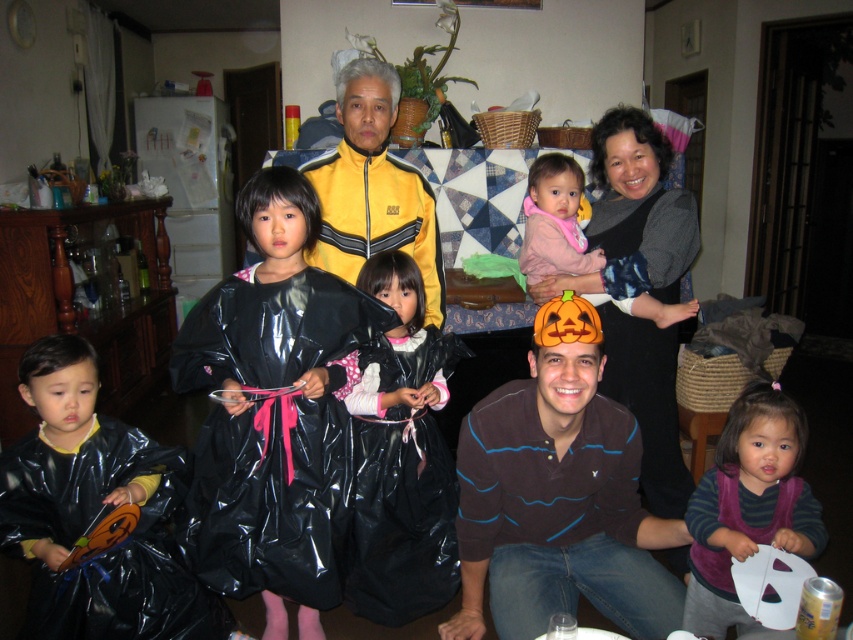
Question: Which object is closer to the camera taking this photo?

Choices:
 (A) shiny black cape at center
 (B) brown striped shirt at center
 (C) yellowmaterial/texturejacket at upper center

Answer: (B)

Question: Which object is farther from the camera taking this photo?

Choices:
 (A) brown striped shirt at center
 (B) shiny black cape at center
 (C) yellowmaterial/texturejacket at upper center

Answer: (C)

Question: Does glossy black plastic bag at lower left appear under yellowmaterial/texturejacket at upper center?

Choices:
 (A) yes
 (B) no

Answer: (A)

Question: Does glossy black plastic bag at lower left have a larger size compared to shiny black plastic bag at center?

Choices:
 (A) no
 (B) yes

Answer: (B)

Question: Is shiny black cape at center closer to camera compared to yellowmaterial/texturejacket at upper center?

Choices:
 (A) no
 (B) yes

Answer: (B)

Question: Which of the following is the closest to the observer?

Choices:
 (A) (253, 572)
 (B) (735, 465)

Answer: (A)